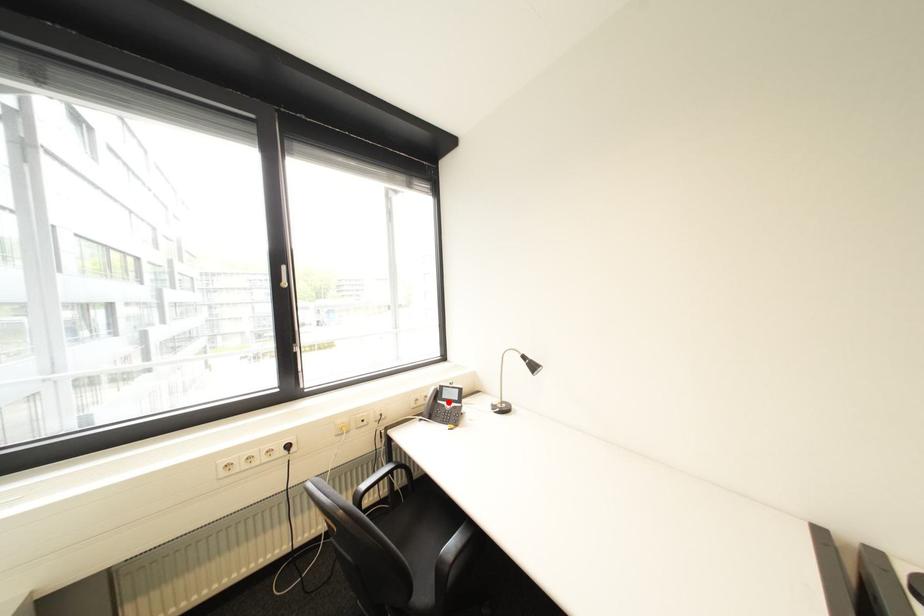
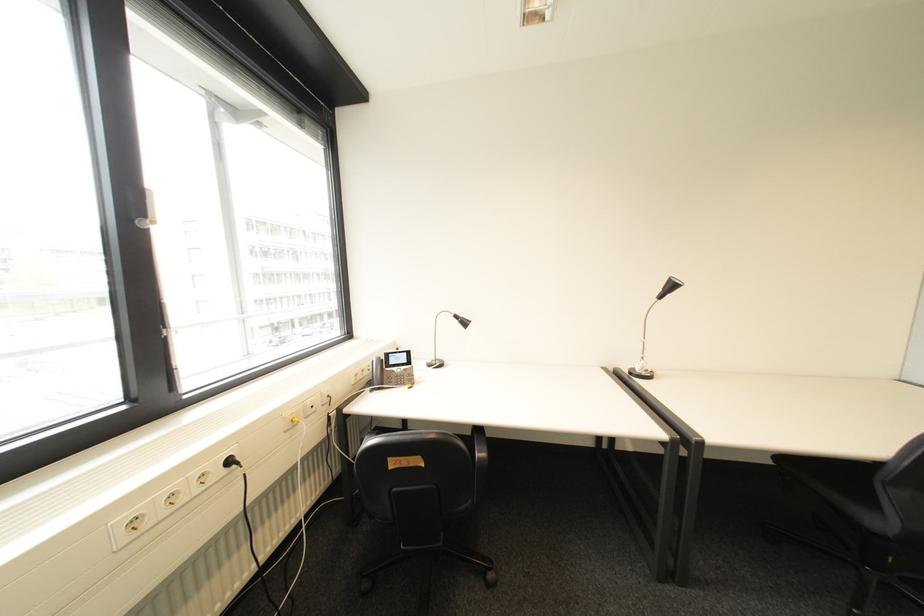
Locate, in the second image, the point that corresponds to the highlighted location in the first image.

(396, 370)